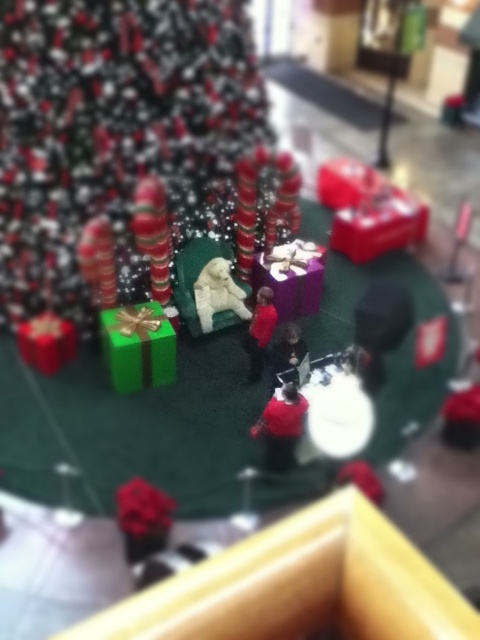
Question: Considering the real-world distances, which object is closest to the shiny metallic candy cane at center?

Choices:
 (A) shiny metallic tree at center
 (B) fluffy white dog at center

Answer: (B)

Question: Does shiny metallic candy cane at center have a lesser width compared to fluffy white dog at center?

Choices:
 (A) no
 (B) yes

Answer: (B)

Question: Can you confirm if shiny metallic candy cane at center is positioned below fluffy white dog at center?

Choices:
 (A) no
 (B) yes

Answer: (A)

Question: Does shiny metallic candy cane at center appear under fluffy white dog at center?

Choices:
 (A) no
 (B) yes

Answer: (A)

Question: Among these objects, which one is nearest to the camera?

Choices:
 (A) shiny metallic tree at center
 (B) shiny metallic candy cane at center

Answer: (A)

Question: Based on their relative distances, which object is nearer to the fluffy white dog at center?

Choices:
 (A) green matte gift at center
 (B) shiny metallic candy cane at center
 (C) shiny metallic tree at center

Answer: (B)